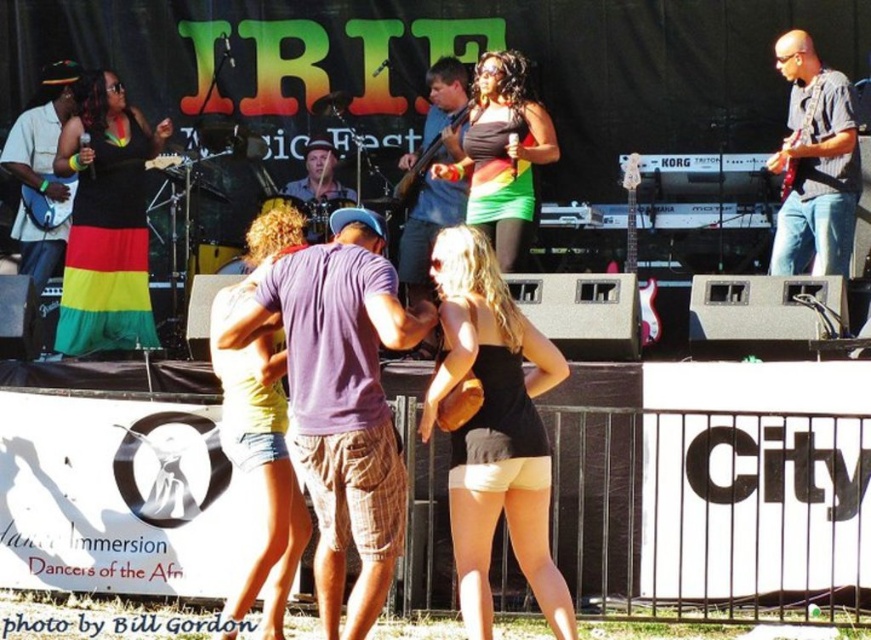
From the picture: Can you confirm if black matte tank top at center is thinner than rasta-patterned dress at left?

Yes.

Who is taller, black matte tank top at center or rasta-patterned dress at left?

Standing taller between the two is rasta-patterned dress at left.

Who is more forward, (471, 566) or (65, 136)?

Positioned in front is point (471, 566).

Locate an element on the screen. This screenshot has height=640, width=871. black matte tank top at center is located at coordinates (494, 429).

Who is more forward, (539, 356) or (309, 176)?

Positioned in front is point (539, 356).

Does black matte tank top at center have a larger size compared to matte brown drum set at center?

Correct, black matte tank top at center is larger in size than matte brown drum set at center.

Which is behind, point (514, 435) or point (333, 182)?

The point (333, 182) is behind.

I want to click on black matte tank top at center, so click(494, 429).

Which is below, rasta-patterned dress at left or matte blue shirt at center?

Positioned lower is rasta-patterned dress at left.

Is rasta-patterned dress at left below matte blue shirt at center?

Indeed, rasta-patterned dress at left is positioned under matte blue shirt at center.

Does point (110, 112) come behind point (404, 253)?

No, it is in front of (404, 253).

Image resolution: width=871 pixels, height=640 pixels. I want to click on rasta-patterned dress at left, so click(x=106, y=221).